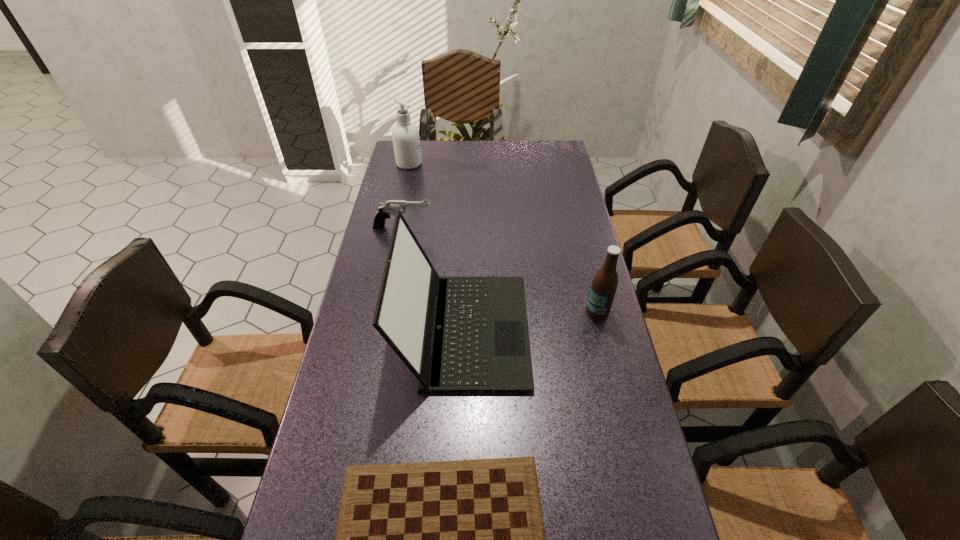
Image resolution: width=960 pixels, height=540 pixels. Identify the location of free space that satisfies the following two spatial constraints: 1. on the front side of the rightmost object; 2. on the surface of the laptop. (602, 330).